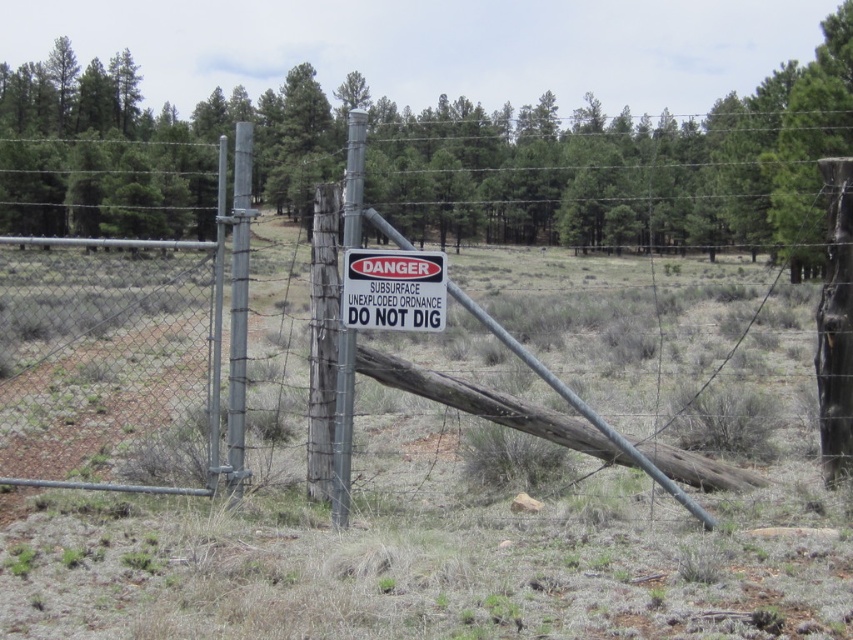
Question: In this image, where is metal wire fence at center located relative to white plastic sign at center?

Choices:
 (A) left
 (B) right

Answer: (B)

Question: Which point appears farthest from the camera in this image?

Choices:
 (A) (392, 250)
 (B) (527, 356)
 (C) (248, 148)

Answer: (C)

Question: Can you confirm if metal wire fence at center is bigger than metallic gray pole at center?

Choices:
 (A) yes
 (B) no

Answer: (A)

Question: Among these objects, which one is nearest to the camera?

Choices:
 (A) metallic gray pole at center-left
 (B) green textured log at center
 (C) metal wire fence at center

Answer: (C)

Question: Where is metal wire fence at center located in relation to metallic gray pole at center-left in the image?

Choices:
 (A) above
 (B) below

Answer: (B)

Question: Which point is closer to the camera?

Choices:
 (A) (762, 300)
 (B) (537, 136)
 (C) (244, 269)

Answer: (C)